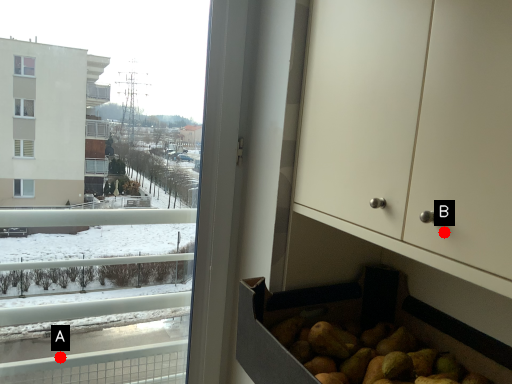
Question: Two points are circled on the image, labeled by A and B beside each circle. Which point appears closest to the camera in this image?

Choices:
 (A) A is closer
 (B) B is closer

Answer: (B)